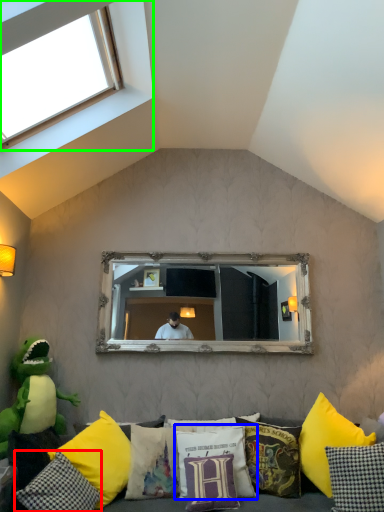
Question: Which object is positioned closest to pillow (highlighted by a red box)? Select from pillow (highlighted by a blue box) and window (highlighted by a green box).

Choices:
 (A) pillow
 (B) window

Answer: (A)